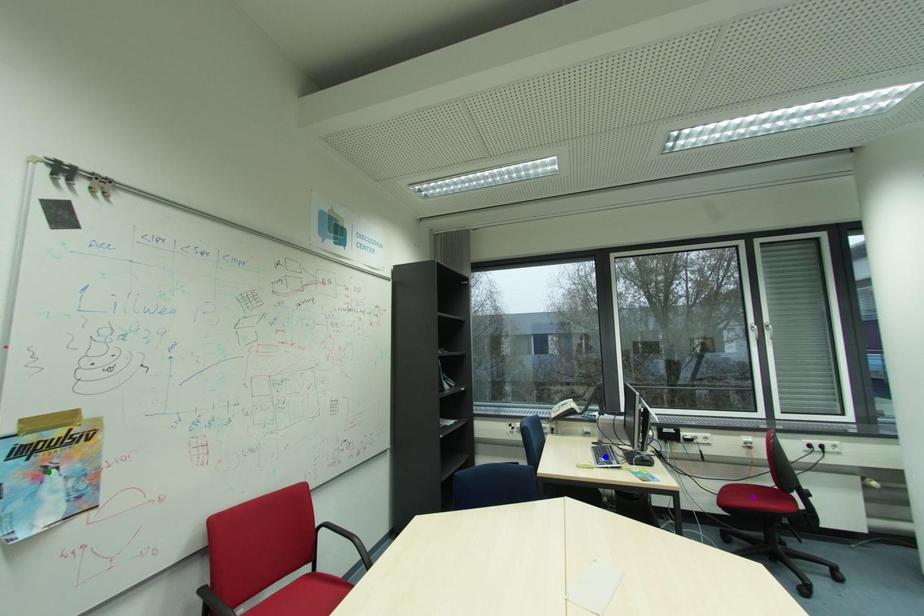
Order these from nearest to farthest:
- blue point
- purple point
- green point

blue point < purple point < green point